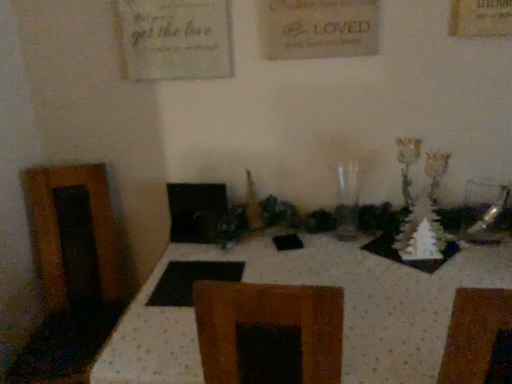
The width and height of the screenshot is (512, 384). I want to click on transparent glass vase at center, so click(x=348, y=200).

Measure the distance between transparent glass vase at center and camera.

5.66 feet.

Describe the element at coordinates (348, 200) in the screenshot. The height and width of the screenshot is (384, 512). I see `transparent glass vase at center` at that location.

The height and width of the screenshot is (384, 512). What do you see at coordinates (313, 284) in the screenshot?
I see `white dotted fabric at center` at bounding box center [313, 284].

Where is `white dotted fabric at center`? This screenshot has height=384, width=512. white dotted fabric at center is located at coordinates (313, 284).

Locate an element on the screen. transparent glass vase at center is located at coordinates (348, 200).

Which is more to the left, white dotted fabric at center or transparent glass vase at center?

Positioned to the left is white dotted fabric at center.

In the scene shown: Is white dotted fabric at center further to the viewer compared to transparent glass vase at center?

No.

Which point is more distant from viewer, [421,302] or [347,205]?

Positioned behind is point [347,205].

From the image's perspective, which one is positioned higher, white dotted fabric at center or transparent glass vase at center?

transparent glass vase at center appears higher in the image.

From a real-world perspective, between white dotted fabric at center and transparent glass vase at center, who is vertically higher?

transparent glass vase at center is physically above.

Considering the sizes of white dotted fabric at center and transparent glass vase at center in the image, is white dotted fabric at center wider or thinner than transparent glass vase at center?

white dotted fabric at center is wider than transparent glass vase at center.

From their relative heights in the image, would you say white dotted fabric at center is taller or shorter than transparent glass vase at center?

Considering their sizes, white dotted fabric at center has more height than transparent glass vase at center.

Between white dotted fabric at center and transparent glass vase at center, which one has smaller size?

transparent glass vase at center is smaller.

In the scene shown: Which is correct: white dotted fabric at center is inside transparent glass vase at center, or outside of it?

white dotted fabric at center exists outside the volume of transparent glass vase at center.

Is white dotted fabric at center next to transparent glass vase at center and touching it?

No, white dotted fabric at center is not in contact with transparent glass vase at center.

Is white dotted fabric at center turned away from transparent glass vase at center?

No, white dotted fabric at center is not facing away from transparent glass vase at center.

In the image, there is a transparent glass vase at center. Where is `table below it (from a real-world perspective)`? The height and width of the screenshot is (384, 512). table below it (from a real-world perspective) is located at coordinates (313, 284).

Does transparent glass vase at center appear on the left side of white dotted fabric at center?

Incorrect, transparent glass vase at center is not on the left side of white dotted fabric at center.

Does transparent glass vase at center come in front of white dotted fabric at center?

That is False.

Considering the points (356, 171) and (367, 287), which point is in front, point (356, 171) or point (367, 287)?

The point (367, 287) is more forward.

Consider the image. From the image's perspective, which one is positioned higher, transparent glass vase at center or white dotted fabric at center?

transparent glass vase at center is shown above in the image.

Consider the image. From a real-world perspective, who is located lower, transparent glass vase at center or white dotted fabric at center?

white dotted fabric at center.

Which of these two, transparent glass vase at center or white dotted fabric at center, is thinner?

transparent glass vase at center is thinner.

Between transparent glass vase at center and white dotted fabric at center, which one has more height?

Standing taller between the two is white dotted fabric at center.

In terms of size, does transparent glass vase at center appear bigger or smaller than white dotted fabric at center?

Considering their sizes, transparent glass vase at center takes up less space than white dotted fabric at center.

Is transparent glass vase at center situated inside white dotted fabric at center or outside?

transparent glass vase at center cannot be found inside white dotted fabric at center.

Would you consider transparent glass vase at center to be distant from white dotted fabric at center?

Actually, transparent glass vase at center and white dotted fabric at center are a little close together.

Is transparent glass vase at center facing towards white dotted fabric at center?

No, transparent glass vase at center does not turn towards white dotted fabric at center.

What's the angular difference between transparent glass vase at center and white dotted fabric at center's facing directions?

There is a 1.15-degree angle between the facing directions of transparent glass vase at center and white dotted fabric at center.

I want to click on table in front of the transparent glass vase at center, so click(313, 284).

The height and width of the screenshot is (384, 512). I want to click on table below the transparent glass vase at center (from the image's perspective), so click(x=313, y=284).

Image resolution: width=512 pixels, height=384 pixels. Identify the location of table on the left of the transparent glass vase at center. (313, 284).